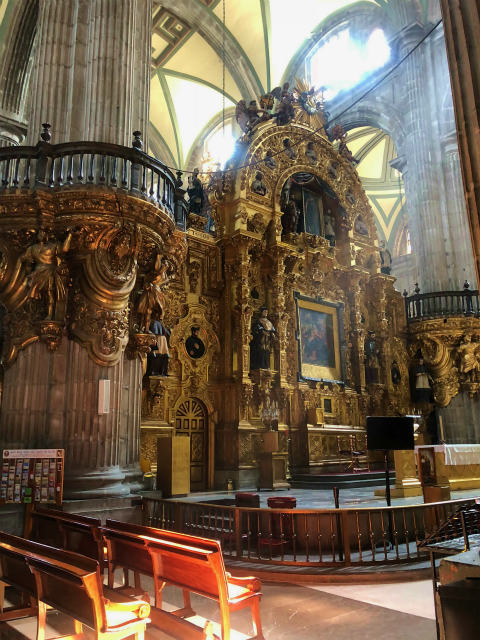
You are a GUI agent. You are given a task and a screenshot of the screen. Output one action in this format:
    pyautogui.click(x=<x>, y=<y>)
    Task: Click on the candle
    The width and height of the screenshot is (480, 640).
    Given the screenshot: What is the action you would take?
    pyautogui.click(x=442, y=426)